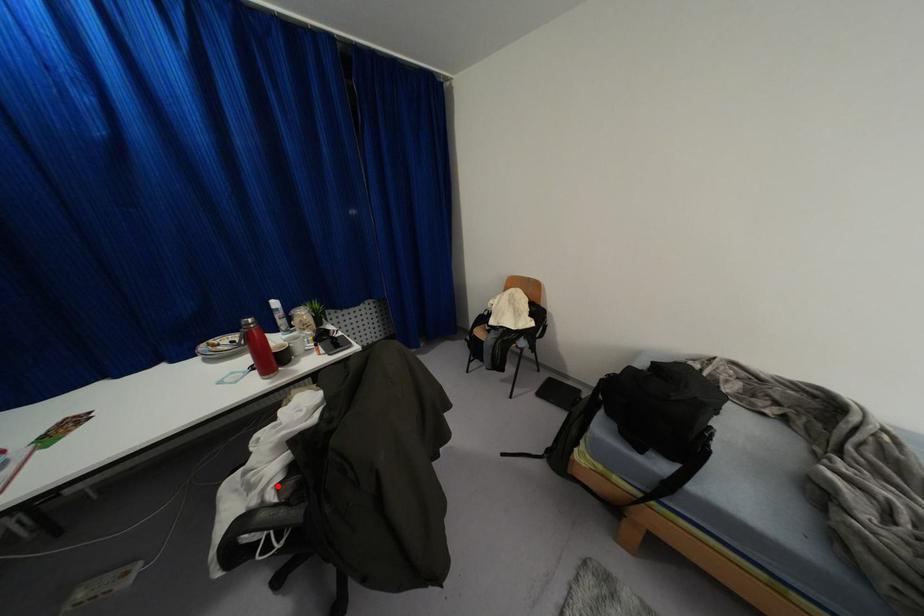
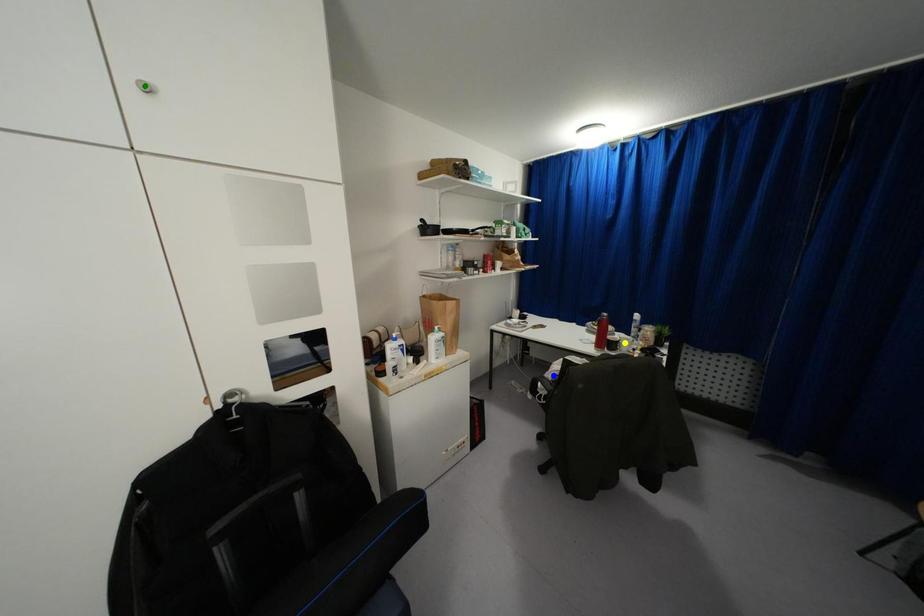
Question: I am providing you with two images of the same scene from different viewpoints. A red point is marked on the first image. You are given multiple points on the second image. Which point in image 2 is actually the same real-world point as the red point in image 1?

Choices:
 (A) blue point
 (B) green point
 (C) yellow point

Answer: (A)